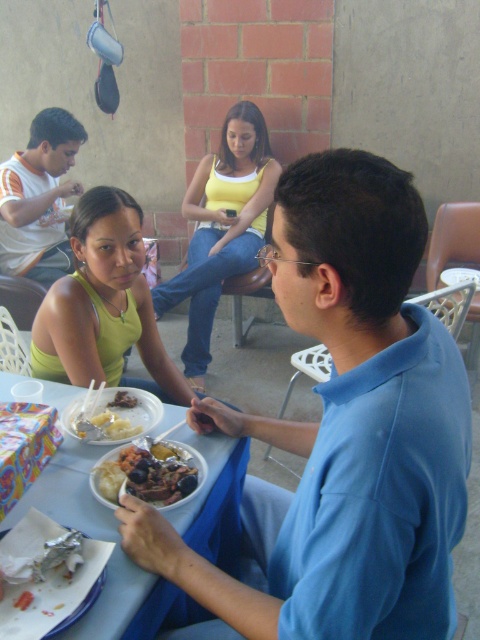
You are a server at the restaurant and need to place a new dish on the table. The dish requires a space wider than the shiny metallic bowl at center. Can the yellow cotton tank top at center provide enough space for this?

The yellow cotton tank top at center has a larger width than the shiny metallic bowl at center, so it can provide enough space for the dish requiring a wider area than the bowl.

You are a photographer trying to capture a candid shot of the two people at the dining table. You notice two points of interest marked as point 1 at coordinates point [217,269] and point 2 at coordinates point [86,410]. Which point is closer to your camera lens?

Point [217,269] is closer to the camera lens because it is further to the viewer than point [86,410].

You are sitting at the table in the image and want to reach for the item located at point (440, 497). Is this item closer to you than the item at point (264, 202)?

Yes, the item at point (440, 497) is closer because it is in front of the item at point (264, 202).